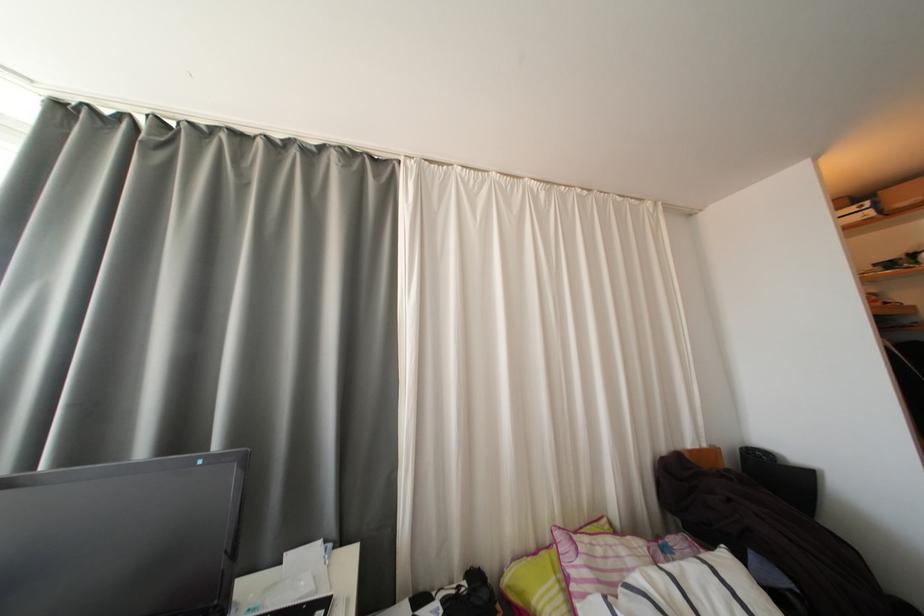
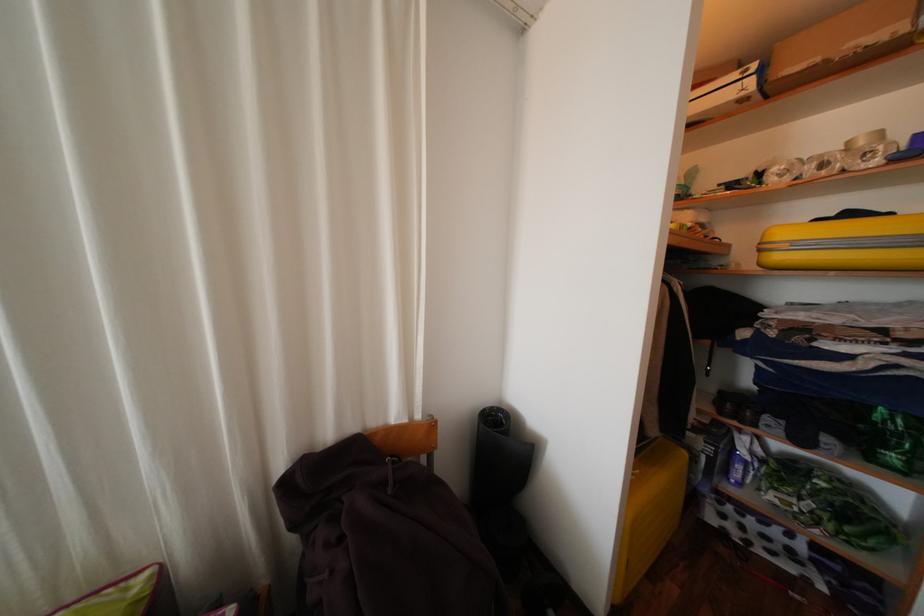
Which direction would the cameraman need to move to produce the second image?

The cameraman walked toward right, forward.